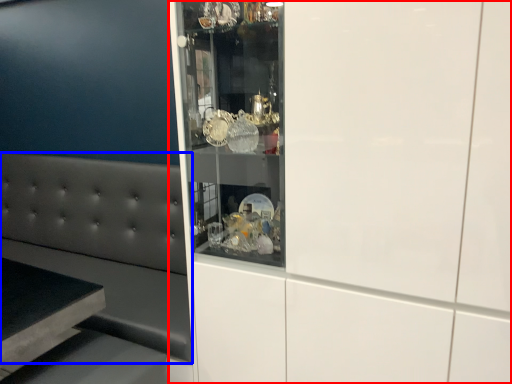
Question: Among these objects, which one is nearest to the camera, cabinetry (highlighted by a red box) or furniture (highlighted by a blue box)?

Choices:
 (A) cabinetry
 (B) furniture

Answer: (A)